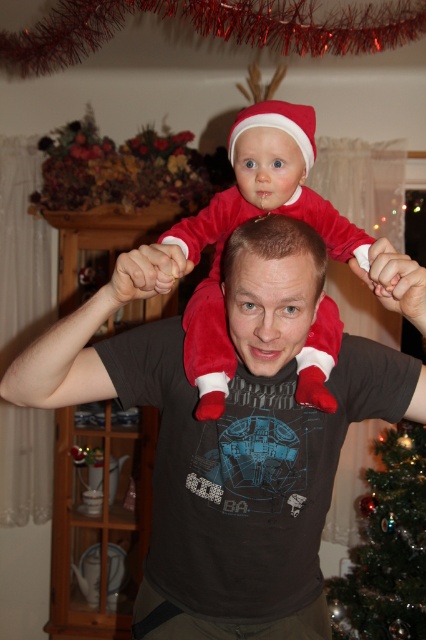
Does point (324, 419) come farther from viewer compared to point (285, 355)?

Yes.

Is matte black t-shirt at center above matte red santa hat at center?

No, matte black t-shirt at center is not above matte red santa hat at center.

Locate an element on the screen. The width and height of the screenshot is (426, 640). matte black t-shirt at center is located at coordinates (193, 448).

Where is `matte black t-shirt at center`? The width and height of the screenshot is (426, 640). matte black t-shirt at center is located at coordinates (193, 448).

Is shiny green christmas tree at lower right wider than matte red santa hat at center?

Yes.

Between shiny green christmas tree at lower right and matte red santa hat at center, which one has more height?

shiny green christmas tree at lower right

Does point (379, 529) come behind point (304, 224)?

That is True.

Locate an element on the screen. shiny green christmas tree at lower right is located at coordinates (386, 547).

Between matte black t-shirt at center and velvet red santa suit at center, which one appears on the left side from the viewer's perspective?

matte black t-shirt at center

Is matte black t-shirt at center above velvet red santa suit at center?

Incorrect, matte black t-shirt at center is not positioned above velvet red santa suit at center.

This screenshot has width=426, height=640. Identify the location of matte black t-shirt at center. (193, 448).